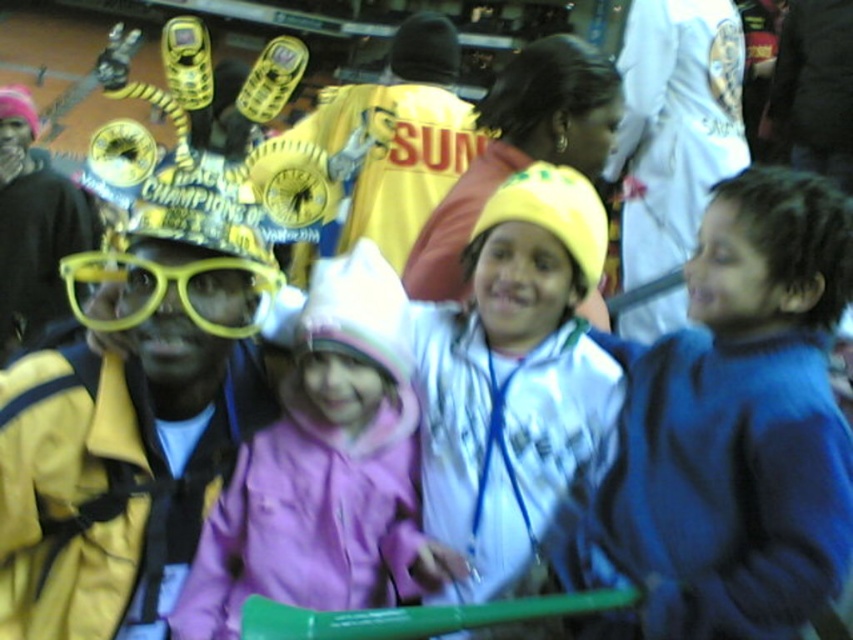
Question: Can you confirm if white matte jacket at center is positioned to the right of pink fleece jacket at center?

Choices:
 (A) no
 (B) yes

Answer: (B)

Question: Which object is closer to the camera taking this photo?

Choices:
 (A) pink fleece jacket at center
 (B) yellow matte/glossy goggles at left
 (C) blue fleece jacket at right

Answer: (C)

Question: Can you confirm if blue fleece jacket at right is smaller than white matte jacket at center?

Choices:
 (A) yes
 (B) no

Answer: (A)

Question: Which of the following is the closest to the observer?

Choices:
 (A) (718, 449)
 (B) (247, 340)
 (C) (492, 145)
 (D) (526, 209)

Answer: (A)

Question: From the image, what is the correct spatial relationship of blue fleece jacket at right in relation to yellow fabric hat at upper center?

Choices:
 (A) right
 (B) left

Answer: (A)

Question: Based on their relative distances, which object is nearer to the yellow matte/glossy goggles at left?

Choices:
 (A) pink fleece jacket at center
 (B) white matte jacket at center
 (C) blue fleece jacket at right

Answer: (A)